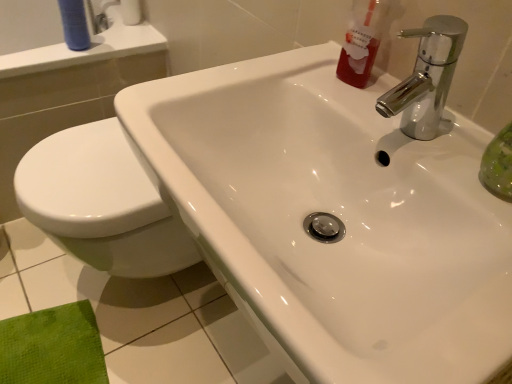
Identify the location of vacant region to the left of chrome metallic faucet at upper right. The height and width of the screenshot is (384, 512). (303, 96).